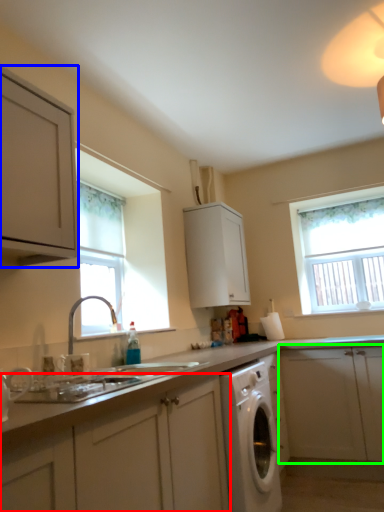
Question: Considering the real-world distances, which object is farthest from cabinetry (highlighted by a red box)? cabinetry (highlighted by a blue box) or cabinetry (highlighted by a green box)?

Choices:
 (A) cabinetry
 (B) cabinetry

Answer: (B)